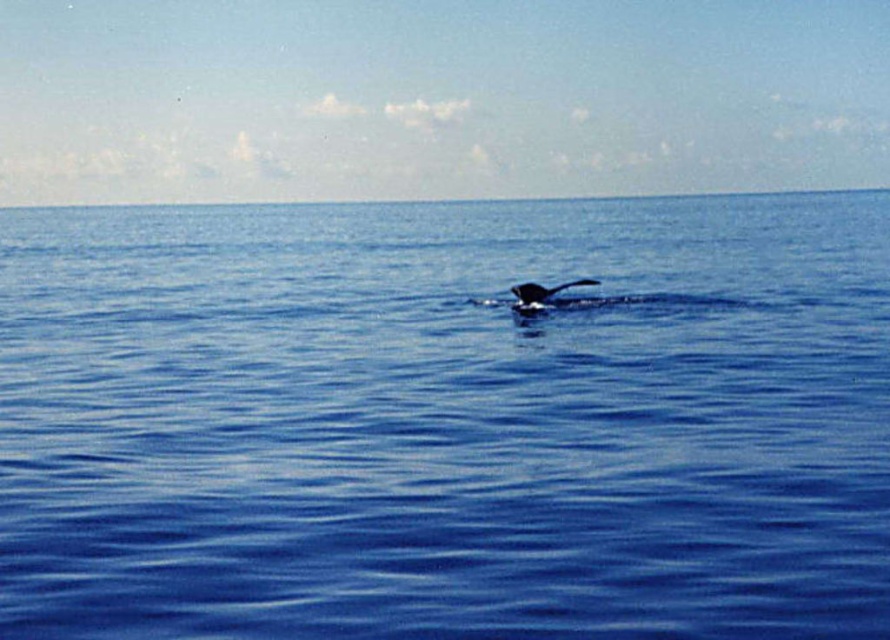
Question: Is blue water at center wider than gray matte whale at center?

Choices:
 (A) yes
 (B) no

Answer: (A)

Question: Is blue water at center below gray matte whale at center?

Choices:
 (A) yes
 (B) no

Answer: (B)

Question: Which object appears closest to the camera in this image?

Choices:
 (A) blue water at center
 (B) gray matte whale at center

Answer: (A)

Question: Which object is farther from the camera taking this photo?

Choices:
 (A) gray matte whale at center
 (B) blue water at center

Answer: (A)

Question: Is blue water at center to the left of gray matte whale at center from the viewer's perspective?

Choices:
 (A) yes
 (B) no

Answer: (B)